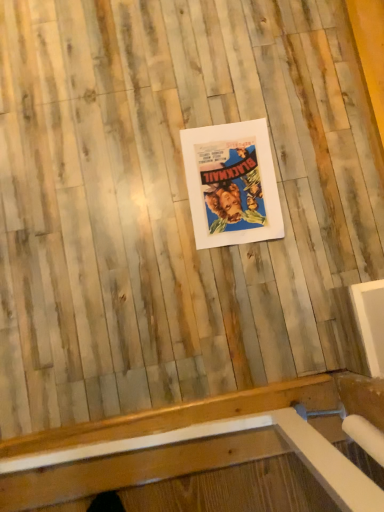
Identify the location of empty space that is ontop of white matte picture frame at center (from a real-world perspective). This screenshot has width=384, height=512. (231, 181).